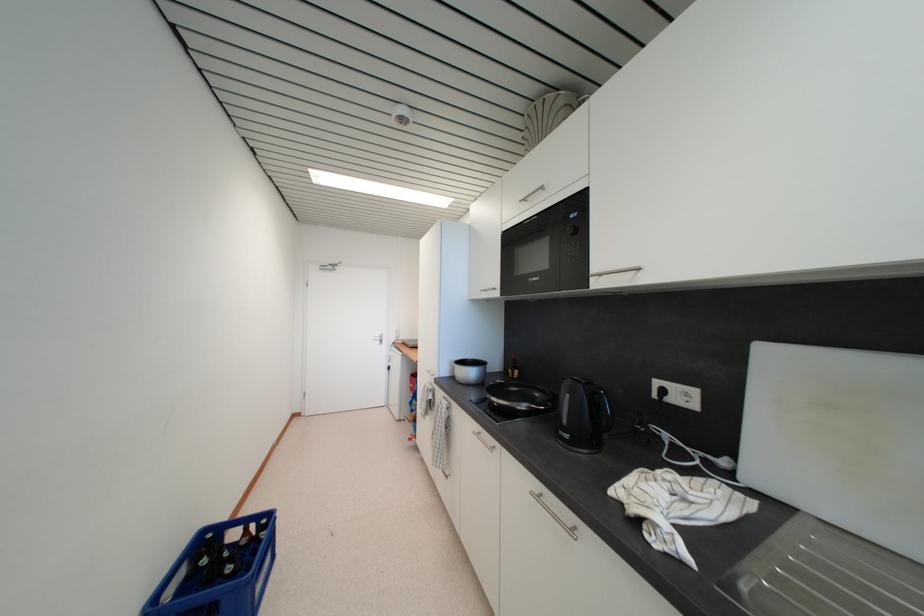
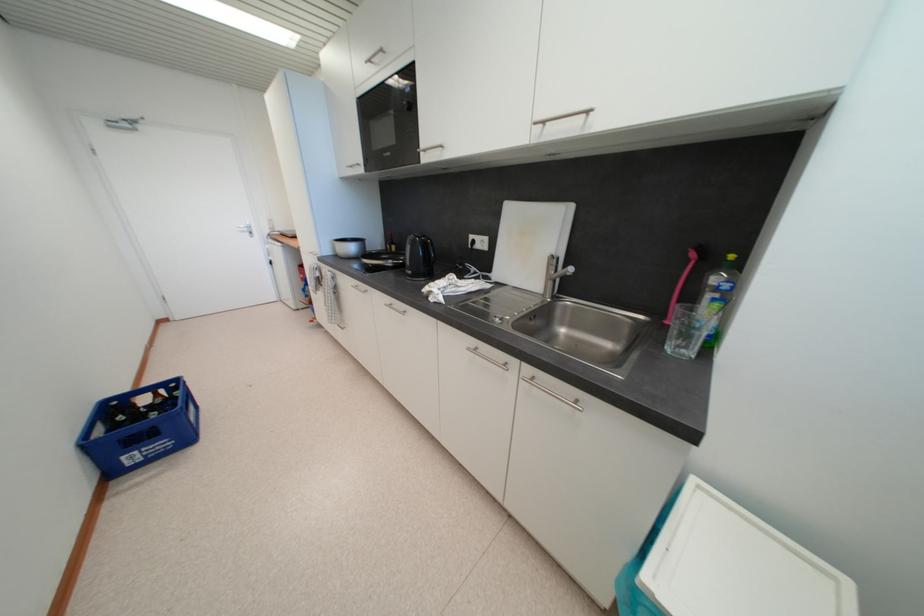
The point at [599,272] is marked in the first image. Where is the corresponding point in the second image?

(428, 148)